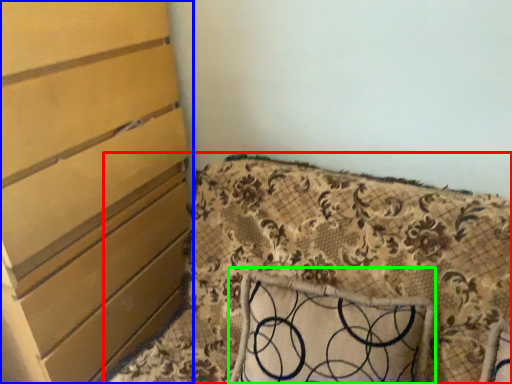
Question: Which object is the closest to the furniture (highlighted by a red box)? Choose among these: chest of drawers (highlighted by a blue box) or pillow (highlighted by a green box).

Choices:
 (A) chest of drawers
 (B) pillow

Answer: (B)